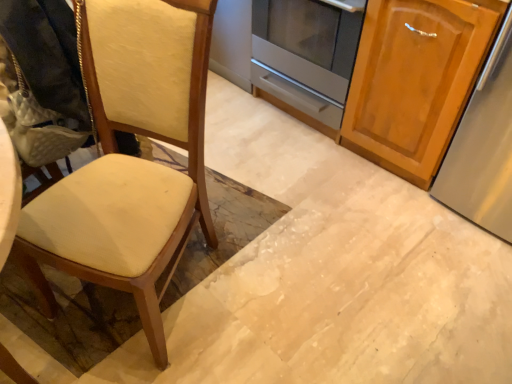
Locate an element on the screen. This screenshot has width=512, height=384. wooden cabinet at right is located at coordinates (415, 80).

Describe the element at coordinates (304, 58) in the screenshot. I see `satin silver oven at center` at that location.

Locate an element on the screen. This screenshot has width=512, height=384. matte cream fabric chair at left is located at coordinates [130, 158].

From the image's perspective, who appears lower, wooden cabinet at right or satin silver oven at center?

From the image's view, wooden cabinet at right is below.

Are wooden cabinet at right and satin silver oven at center far apart?

They are positioned close to each other.

Which point is more forward, (374,37) or (328,26)?

The point (374,37) is closer.

What's the angular difference between wooden cabinet at right and satin silver oven at center's facing directions?

They differ by 0.859 degrees in their facing directions.

Considering the sizes of satin silver oven at center and matte cream fabric chair at left in the image, is satin silver oven at center wider or thinner than matte cream fabric chair at left?

Clearly, satin silver oven at center has less width compared to matte cream fabric chair at left.

Find the location of a particular element. This screenshot has height=384, width=512. chair above the satin silver oven at center (from a real-world perspective) is located at coordinates pos(130,158).

Is satin silver oven at center further to camera compared to matte cream fabric chair at left?

Yes, satin silver oven at center is behind matte cream fabric chair at left.

Is matte cream fabric chair at left at the back of satin silver oven at center?

No.

From a real-world perspective, relative to satin silver oven at center, is matte cream fabric chair at left vertically above or below?

From a real-world perspective, matte cream fabric chair at left is physically above satin silver oven at center.

In terms of height, does matte cream fabric chair at left look taller or shorter compared to satin silver oven at center?

Clearly, matte cream fabric chair at left is taller compared to satin silver oven at center.

Is matte cream fabric chair at left facing away from satin silver oven at center?

Yes.

Which is farther, [35,215] or [338,129]?

Positioned behind is point [338,129].

What's the angular difference between matte cream fabric chair at left and wooden cabinet at right's facing directions?

The angle between the facing direction of matte cream fabric chair at left and the facing direction of wooden cabinet at right is 26.4 degrees.

From the image's perspective, is matte cream fabric chair at left located above or below wooden cabinet at right?

From the image's perspective, matte cream fabric chair at left appears below wooden cabinet at right.

Is matte cream fabric chair at left shorter than wooden cabinet at right?

In fact, matte cream fabric chair at left may be taller than wooden cabinet at right.

You are a GUI agent. You are given a task and a screenshot of the screen. Output one action in this format:
    pyautogui.click(x=<x>, y=<y>)
    Task: Click on the chair in front of the wooden cabinet at right
    
    Given the screenshot: What is the action you would take?
    pyautogui.click(x=130, y=158)

Could you tell me if satin silver oven at center is facing wooden cabinet at right?

No, satin silver oven at center is not aimed at wooden cabinet at right.

Considering the relative sizes of satin silver oven at center and wooden cabinet at right in the image provided, is satin silver oven at center taller than wooden cabinet at right?

No, satin silver oven at center is not taller than wooden cabinet at right.

From a real-world perspective, relative to wooden cabinet at right, is satin silver oven at center vertically above or below?

satin silver oven at center is below wooden cabinet at right.

Between point (418, 179) and point (44, 248), which one is positioned in front?

The point (44, 248) is in front.

Is wooden cabinet at right at the right side of matte cream fabric chair at left?

Correct, you'll find wooden cabinet at right to the right of matte cream fabric chair at left.

Is wooden cabinet at right directly adjacent to matte cream fabric chair at left?

They are not placed beside each other.

Who is smaller, wooden cabinet at right or matte cream fabric chair at left?

wooden cabinet at right.

Identify the location of cabinetry above the satin silver oven at center (from a real-world perspective). The width and height of the screenshot is (512, 384). [415, 80].

Where is `oven above the matte cream fabric chair at left (from the image's perspective)`? This screenshot has height=384, width=512. oven above the matte cream fabric chair at left (from the image's perspective) is located at coordinates (304, 58).

Based on their spatial positions, is matte cream fabric chair at left or wooden cabinet at right further from satin silver oven at center?

Based on the image, matte cream fabric chair at left appears to be further to satin silver oven at center.

Looking at the image, which one is located closer to wooden cabinet at right, matte cream fabric chair at left or satin silver oven at center?

satin silver oven at center lies closer to wooden cabinet at right than the other object.

When comparing their distances from matte cream fabric chair at left, does satin silver oven at center or wooden cabinet at right seem further?

Based on the image, satin silver oven at center appears to be further to matte cream fabric chair at left.

Which object lies nearer to the anchor point wooden cabinet at right, satin silver oven at center or matte cream fabric chair at left?

Among the two, satin silver oven at center is located nearer to wooden cabinet at right.

Looking at the image, which one is located closer to satin silver oven at center, wooden cabinet at right or matte cream fabric chair at left?

Among the two, wooden cabinet at right is located nearer to satin silver oven at center.

Looking at the image, which one is located closer to matte cream fabric chair at left, wooden cabinet at right or satin silver oven at center?

Among the two, wooden cabinet at right is located nearer to matte cream fabric chair at left.

Locate an element on the screen. oven between matte cream fabric chair at left and wooden cabinet at right is located at coordinates (304, 58).